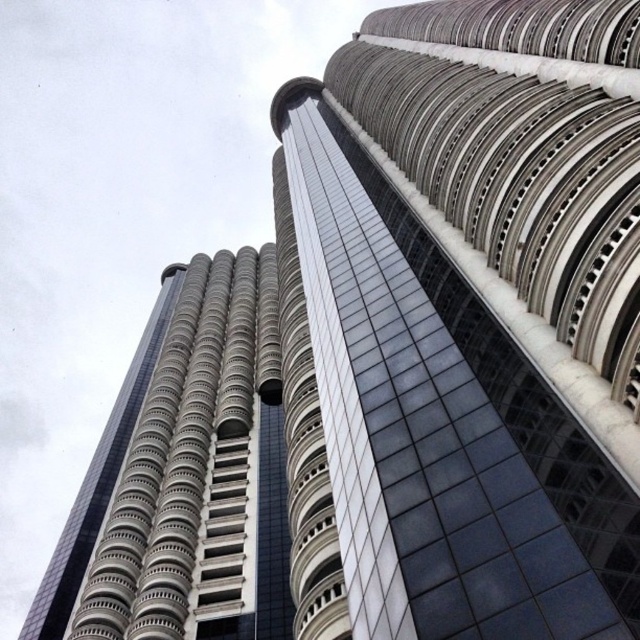
You are a photographer planning to capture the Petronas Twin Towers from a specific angle. You notice the metallic glass skyscraper at center and the silver metallic tower at center. Which one appears higher in the frame?

The metallic glass skyscraper at center is located above the silver metallic tower at center, so it appears higher in the frame.

You are a photographer planning to capture a wide shot of both the metallic glass skyscraper at center and the silver metallic tower at center. Given their widths, which one should you position closer to the center of your frame to ensure both fit within the shot?

The metallic glass skyscraper at center is narrower than the silver metallic tower at center, so positioning the silver metallic tower at center closer to the center of the frame would allow both to fit better within the shot.

You are a photographer planning to capture a wide shot of both the metallic glass skyscraper at center and the silver metallic tower at center. Based on their sizes in the image, which one should you ensure is positioned closer to the center of your camera frame to maintain balance?

The metallic glass skyscraper at center is larger in size than the silver metallic tower at center, so to maintain balance in the frame, position the smaller silver metallic tower at center closer to the center of the camera frame while placing the larger metallic glass skyscraper at center slightly off to the side.